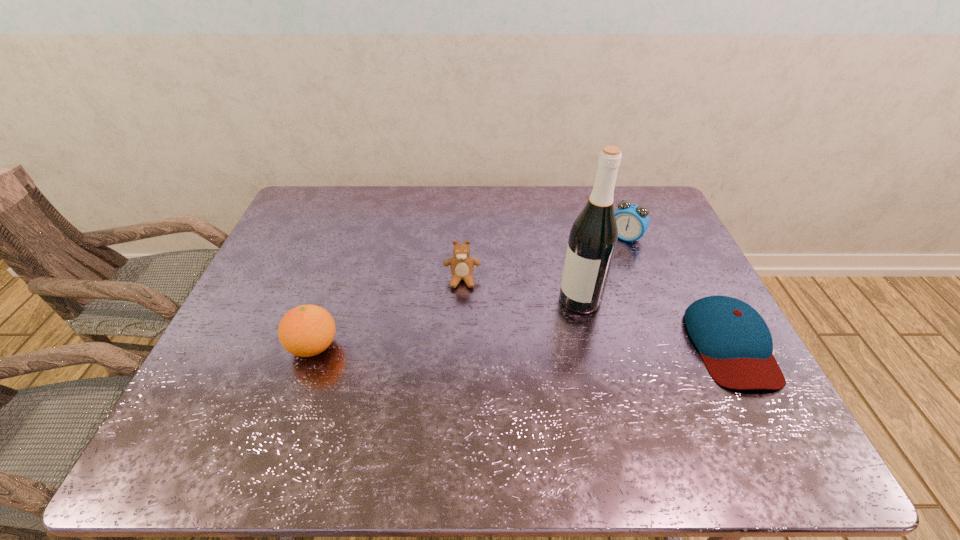
In order to click on vacant space that is in between the shortest object and the wine bottle in this screenshot , I will do `click(656, 322)`.

You are a GUI agent. You are given a task and a screenshot of the screen. Output one action in this format:
    pyautogui.click(x=<x>, y=<y>)
    Task: Click on the free space that is in between the fourth object from right to left and the third object from left to right
    The height and width of the screenshot is (540, 960).
    Given the screenshot: What is the action you would take?
    pyautogui.click(x=521, y=290)

Locate an element on the screen. Image resolution: width=960 pixels, height=540 pixels. free space between the leftmost object and the shortest object is located at coordinates (522, 346).

Where is `empty space between the orange and the farthest object`? empty space between the orange and the farthest object is located at coordinates (469, 292).

The width and height of the screenshot is (960, 540). Identify the location of vacant area that lies between the teddy bear and the leftmost object. (388, 313).

The image size is (960, 540). I want to click on empty location between the tallest object and the fourth object from right to left, so click(521, 290).

Where is `free point between the orange and the tallest object`? Image resolution: width=960 pixels, height=540 pixels. free point between the orange and the tallest object is located at coordinates (446, 323).

Where is `the fourth closest object to the leftmost object`? The width and height of the screenshot is (960, 540). the fourth closest object to the leftmost object is located at coordinates (735, 343).

Where is `object that is the third closest to the fourth object from right to left`? The height and width of the screenshot is (540, 960). object that is the third closest to the fourth object from right to left is located at coordinates (633, 220).

Locate an element on the screen. This screenshot has width=960, height=540. blank space that satisfies the following two spatial constraints: 1. on the back side of the leftmost object; 2. on the left side of the alarm clock is located at coordinates (351, 237).